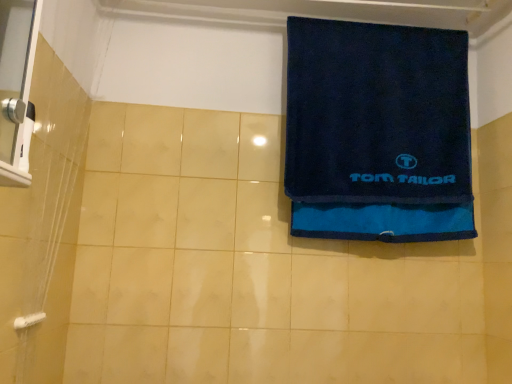
Locate an element on the screen. dark blue terry cloth towel at upper right is located at coordinates (378, 132).

This screenshot has height=384, width=512. What do you see at coordinates (378, 132) in the screenshot? I see `dark blue terry cloth towel at upper right` at bounding box center [378, 132].

You are a GUI agent. You are given a task and a screenshot of the screen. Output one action in this format:
    pyautogui.click(x=<x>, y=<y>)
    Task: Click on the white plastic towel bar at lower left
    Image resolution: width=512 pixels, height=384 pixels.
    Given the screenshot: What is the action you would take?
    pyautogui.click(x=28, y=320)

This screenshot has width=512, height=384. What do you see at coordinates (28, 320) in the screenshot?
I see `white plastic towel bar at lower left` at bounding box center [28, 320].

Based on the photo, measure the distance between point (28, 322) and camera.

They are 1.04 meters apart.

The image size is (512, 384). What are the coordinates of `dark blue terry cloth towel at upper right` in the screenshot? It's located at (378, 132).

Visually, is dark blue terry cloth towel at upper right positioned to the left or to the right of white plastic towel bar at lower left?

Based on their positions, dark blue terry cloth towel at upper right is located to the right of white plastic towel bar at lower left.

Looking at this image, is dark blue terry cloth towel at upper right in front of or behind white plastic towel bar at lower left in the image?

In the image, dark blue terry cloth towel at upper right appears behind white plastic towel bar at lower left.

Is point (351, 123) positioned behind point (24, 324)?

Yes, point (351, 123) is farther from viewer.

From the image's perspective, between dark blue terry cloth towel at upper right and white plastic towel bar at lower left, who is located below?

white plastic towel bar at lower left appears lower in the image.

From a real-world perspective, is dark blue terry cloth towel at upper right above or below white plastic towel bar at lower left?

dark blue terry cloth towel at upper right is above white plastic towel bar at lower left.

Does dark blue terry cloth towel at upper right have a greater width compared to white plastic towel bar at lower left?

Indeed, dark blue terry cloth towel at upper right has a greater width compared to white plastic towel bar at lower left.

Is dark blue terry cloth towel at upper right taller or shorter than white plastic towel bar at lower left?

In the image, dark blue terry cloth towel at upper right appears to be taller than white plastic towel bar at lower left.

Which of these two, dark blue terry cloth towel at upper right or white plastic towel bar at lower left, is bigger?

With larger size is dark blue terry cloth towel at upper right.

Is white plastic towel bar at lower left a part of dark blue terry cloth towel at upper right?

No.

Are dark blue terry cloth towel at upper right and white plastic towel bar at lower left located far from each other?

Indeed, dark blue terry cloth towel at upper right is not near white plastic towel bar at lower left.

Could you tell me if dark blue terry cloth towel at upper right is turned towards white plastic towel bar at lower left?

No, dark blue terry cloth towel at upper right is not oriented towards white plastic towel bar at lower left.

From the picture: How many degrees apart are the facing directions of dark blue terry cloth towel at upper right and white plastic towel bar at lower left?

They differ by 88.2 degrees in their facing directions.

At what (x,y) coordinates should I click in order to perform the action: click on towel above the white plastic towel bar at lower left (from the image's perspective). Please return your answer as a coordinate pair (x, y). Looking at the image, I should click on (378, 132).

Does white plastic towel bar at lower left appear on the right side of dark blue terry cloth towel at upper right?

In fact, white plastic towel bar at lower left is to the left of dark blue terry cloth towel at upper right.

Which is behind, white plastic towel bar at lower left or dark blue terry cloth towel at upper right?

dark blue terry cloth towel at upper right is behind.

Is point (32, 319) closer or farther from the camera than point (381, 152)?

Point (32, 319) appears to be closer to the viewer than point (381, 152).

From the image's perspective, does white plastic towel bar at lower left appear higher than dark blue terry cloth towel at upper right?

No, from the image's perspective, white plastic towel bar at lower left is not over dark blue terry cloth towel at upper right.

From a real-world perspective, who is located lower, white plastic towel bar at lower left or dark blue terry cloth towel at upper right?

white plastic towel bar at lower left is physically lower.

Does white plastic towel bar at lower left have a lesser width compared to dark blue terry cloth towel at upper right?

Correct, the width of white plastic towel bar at lower left is less than that of dark blue terry cloth towel at upper right.

Can you confirm if white plastic towel bar at lower left is taller than dark blue terry cloth towel at upper right?

No, white plastic towel bar at lower left is not taller than dark blue terry cloth towel at upper right.

Does white plastic towel bar at lower left have a larger size compared to dark blue terry cloth towel at upper right?

No, white plastic towel bar at lower left is not bigger than dark blue terry cloth towel at upper right.

Is white plastic towel bar at lower left completely or partially outside of dark blue terry cloth towel at upper right?

Indeed, white plastic towel bar at lower left is completely outside dark blue terry cloth towel at upper right.

Is white plastic towel bar at lower left positioned far away from dark blue terry cloth towel at upper right?

Yes, white plastic towel bar at lower left is far from dark blue terry cloth towel at upper right.

Could you tell me if white plastic towel bar at lower left is turned towards dark blue terry cloth towel at upper right?

No, white plastic towel bar at lower left does not turn towards dark blue terry cloth towel at upper right.

What's the angular difference between white plastic towel bar at lower left and dark blue terry cloth towel at upper right's facing directions?

The angle between the facing direction of white plastic towel bar at lower left and the facing direction of dark blue terry cloth towel at upper right is 88.2 degrees.

I want to click on towel bar directly beneath the dark blue terry cloth towel at upper right (from a real-world perspective), so click(28, 320).

Identify the location of towel lying above the white plastic towel bar at lower left (from the image's perspective). The width and height of the screenshot is (512, 384). (378, 132).

The image size is (512, 384). In order to click on towel behind the white plastic towel bar at lower left in this screenshot , I will do `click(378, 132)`.